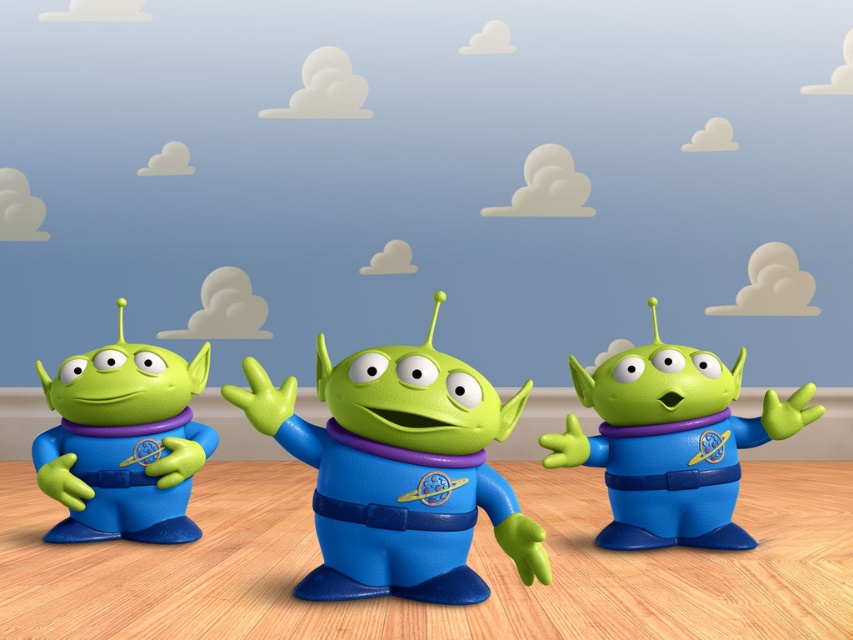
Which of these two, matte green alien at right or matte plastic alien at left, stands shorter?

matte green alien at right is shorter.

Can you confirm if matte green alien at right is smaller than matte plastic alien at left?

Incorrect, matte green alien at right is not smaller in size than matte plastic alien at left.

Who is more distant from viewer, (654, 433) or (45, 385)?

Positioned behind is point (45, 385).

Where is `matte green alien at right`? matte green alien at right is located at coordinates (670, 442).

Can you confirm if matte plastic alien at center is shorter than matte green alien at right?

Indeed, matte plastic alien at center has a lesser height compared to matte green alien at right.

Which is in front, point (341, 412) or point (654, 428)?

Point (341, 412)

The height and width of the screenshot is (640, 853). What do you see at coordinates (398, 472) in the screenshot? I see `matte plastic alien at center` at bounding box center [398, 472].

Locate an element on the screen. matte plastic alien at center is located at coordinates (398, 472).

Which is above, matte plastic alien at center or matte plastic alien at left?

matte plastic alien at center

Where is `matte plastic alien at center`? The height and width of the screenshot is (640, 853). matte plastic alien at center is located at coordinates (398, 472).

Measure the distance between matte plastic alien at center and camera.

They are 4.14 feet apart.

Locate an element on the screen. This screenshot has height=640, width=853. matte plastic alien at center is located at coordinates (398, 472).